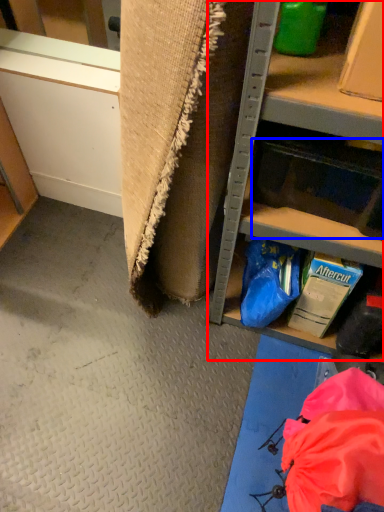
Question: Among these objects, which one is nearest to the camera, shelf (highlighted by a red box) or drawer (highlighted by a blue box)?

Choices:
 (A) shelf
 (B) drawer

Answer: (A)